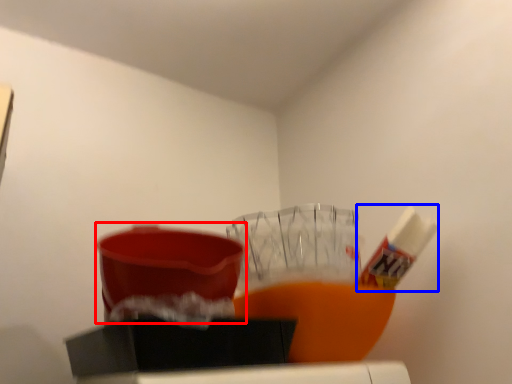
Question: Which of the following is the farthest to the observer, basin (highlighted by a red box) or toothpaste (highlighted by a blue box)?

Choices:
 (A) basin
 (B) toothpaste

Answer: (B)